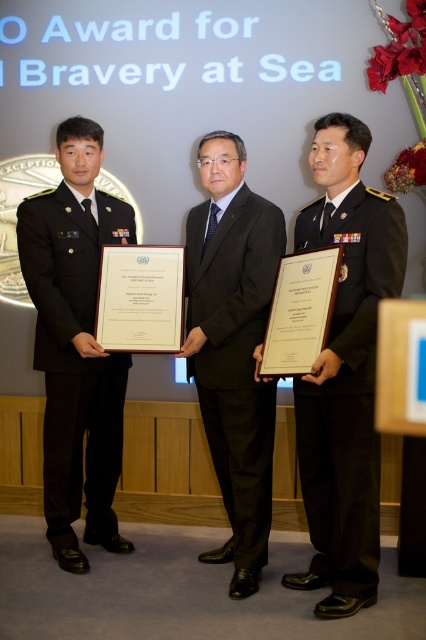
Is dark green uniform at center to the left of black uniform at left from the viewer's perspective?

Incorrect, dark green uniform at center is not on the left side of black uniform at left.

In the scene shown: Is dark green uniform at center taller than black uniform at left?

No.

Find the location of a particular element. This screenshot has height=640, width=426. dark green uniform at center is located at coordinates (347, 394).

Does dark green uniform at center appear over black uniform at center?

Result: Incorrect, dark green uniform at center is not positioned above black uniform at center.

Is dark green uniform at center to the left of black uniform at center from the viewer's perspective?

In fact, dark green uniform at center is to the right of black uniform at center.

Between point (308, 502) and point (267, 413), which one is positioned behind?

The point (267, 413) is more distant.

The height and width of the screenshot is (640, 426). Find the location of `dark green uniform at center`. dark green uniform at center is located at coordinates (347, 394).

Can you confirm if black uniform at left is wider than black uniform at center?

Yes, black uniform at left is wider than black uniform at center.

Who is more forward, [97,502] or [261,554]?

Point [261,554]

The width and height of the screenshot is (426, 640). Identify the location of black uniform at left. (74, 355).